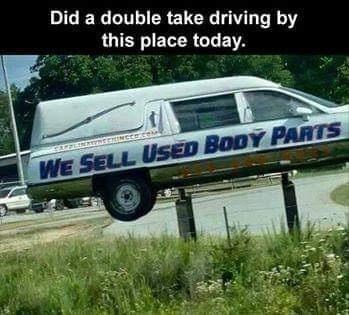
Locate an element on the screen. The height and width of the screenshot is (315, 349). support post is located at coordinates (292, 201), (187, 218).